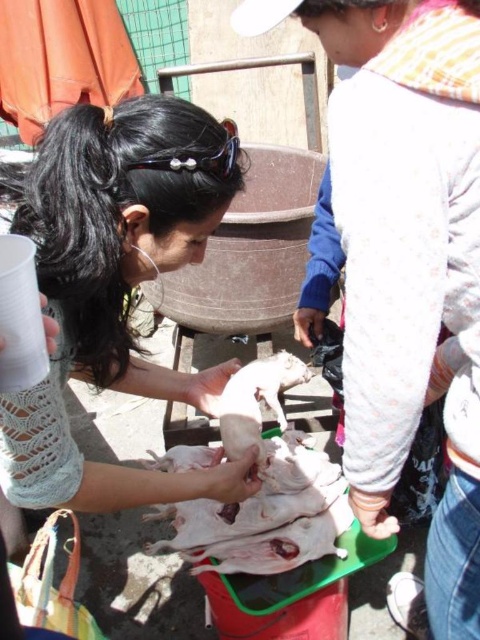
Question: Can you confirm if white raw meat at center is smaller than white smooth piglet at center?

Choices:
 (A) no
 (B) yes

Answer: (A)

Question: Which point appears farthest from the camera in this image?

Choices:
 (A) (262, 365)
 (B) (230, 122)

Answer: (A)

Question: In this image, where is white smooth piglet at center located relative to black plastic goggles at upper center?

Choices:
 (A) below
 (B) above

Answer: (A)

Question: In this image, where is white raw meat at center located relative to white smooth piglet at center?

Choices:
 (A) left
 (B) right

Answer: (A)

Question: Among these objects, which one is farthest from the camera?

Choices:
 (A) matte white shirt at center
 (B) white raw meat at center
 (C) white smooth piglet at center

Answer: (C)

Question: Estimate the real-world distances between objects in this image. Which object is closer to the white smooth piglet at center?

Choices:
 (A) black plastic goggles at upper center
 (B) matte white shirt at center
 (C) white raw meat at center

Answer: (C)